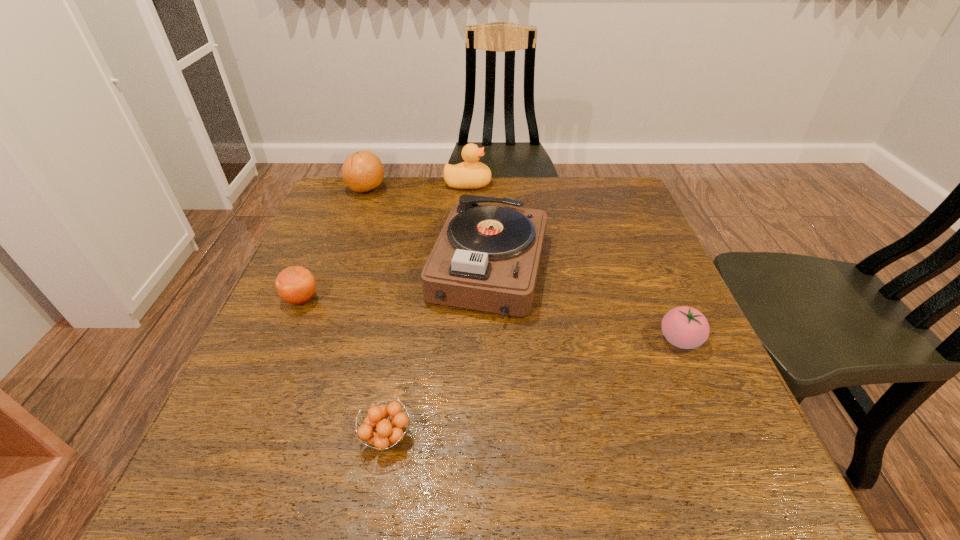
Locate an element on the screen. The width and height of the screenshot is (960, 540). free space between the shortest orange fruit and the second shortest orange fruit is located at coordinates (344, 368).

You are a GUI agent. You are given a task and a screenshot of the screen. Output one action in this format:
    pyautogui.click(x=<x>, y=<y>)
    Task: Click on the vacant area between the rightmost object and the shortest orange fruit
    
    Given the screenshot: What is the action you would take?
    pyautogui.click(x=533, y=389)

Where is `vacant area that lies between the rightmost object and the duck`? The image size is (960, 540). vacant area that lies between the rightmost object and the duck is located at coordinates (574, 262).

I want to click on object that is the fifth nearest to the nearest object, so click(x=471, y=174).

Identify which object is the third closest to the duck. Please provide its 2D coordinates. Your answer should be formatted as a tuple, i.e. [(x, y)], where the tuple contains the x and y coordinates of a point satisfying the conditions above.

[(296, 285)]

Locate an element on the screen. The width and height of the screenshot is (960, 540). orange fruit that stands as the second closest to the farthest orange fruit is located at coordinates (388, 433).

You are a GUI agent. You are given a task and a screenshot of the screen. Output one action in this format:
    pyautogui.click(x=<x>, y=<y>)
    Task: Click on the second closest orange fruit to the duck
    The image size is (960, 540).
    Given the screenshot: What is the action you would take?
    pyautogui.click(x=296, y=285)

Where is `free point that satisfies the following two spatial constraints: 1. on the face of the duck; 2. on the left side of the record player`? Image resolution: width=960 pixels, height=540 pixels. free point that satisfies the following two spatial constraints: 1. on the face of the duck; 2. on the left side of the record player is located at coordinates (465, 268).

Find the location of a particular element. This screenshot has width=960, height=540. vacant region that satisfies the following two spatial constraints: 1. on the front side of the tomato; 2. on the right side of the record player is located at coordinates (491, 340).

The width and height of the screenshot is (960, 540). Identify the location of free location that satisfies the following two spatial constraints: 1. on the face of the rightmost object; 2. on the right side of the duck. (462, 340).